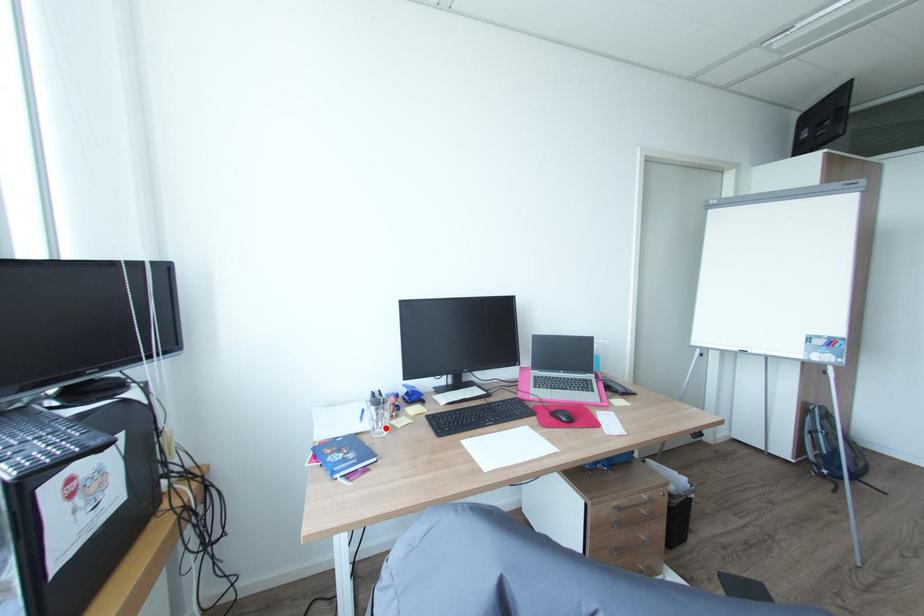
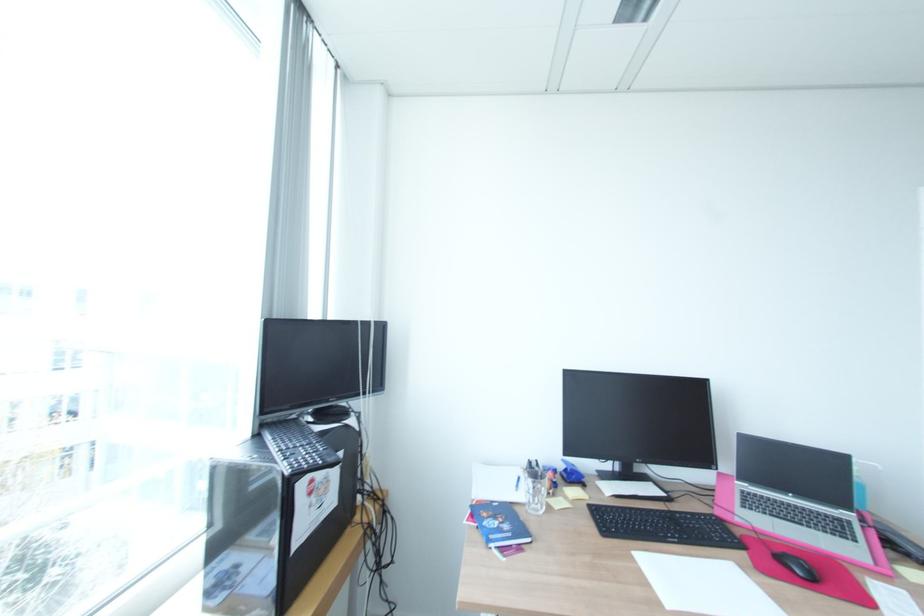
Question: I am providing you with two images of the same scene from different viewpoints. Image1 has a red point marked. In image2, the corresponding 3D location appears at what relative position? Reply with the corresponding letter.

Choices:
 (A) Closer
 (B) Farther

Answer: (B)